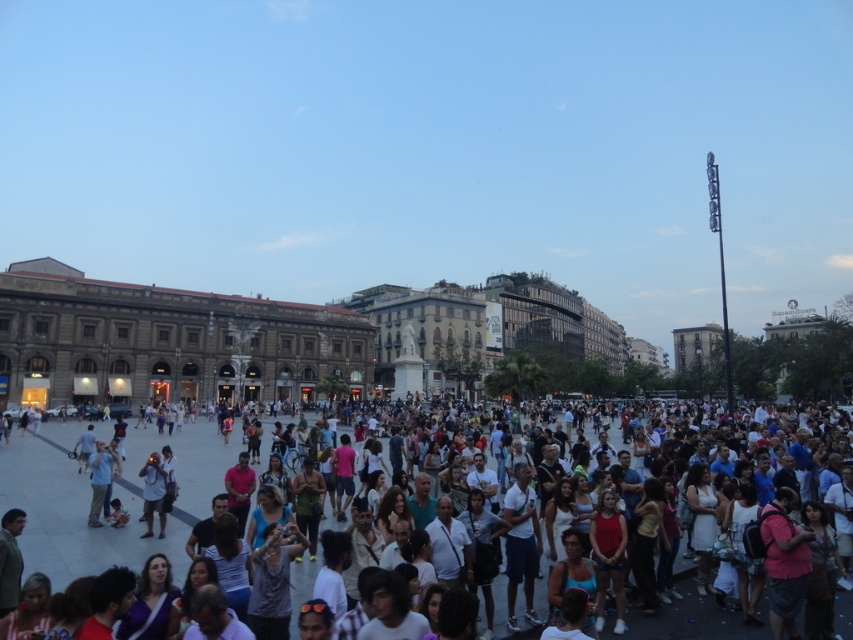
Question: Can you confirm if white cotton shirt at center is bigger than light blue cotton shirt at lower left?

Choices:
 (A) yes
 (B) no

Answer: (A)

Question: Does white cotton shirt at center have a smaller size compared to light blue cotton shirt at lower left?

Choices:
 (A) yes
 (B) no

Answer: (B)

Question: Does white cotton shirt at center lie behind light blue cotton shirt at lower left?

Choices:
 (A) yes
 (B) no

Answer: (B)

Question: Among these points, which one is nearest to the camera?

Choices:
 (A) (97, 499)
 (B) (77, 428)

Answer: (A)

Question: Which point is farther to the camera?

Choices:
 (A) (51, 452)
 (B) (96, 460)

Answer: (A)

Question: Among these points, which one is nearest to the camera?

Choices:
 (A) (33, 528)
 (B) (93, 492)

Answer: (A)